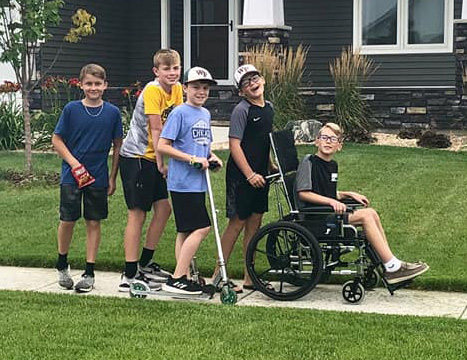
Locate an element on the screen. The height and width of the screenshot is (360, 467). front door is located at coordinates (219, 30).